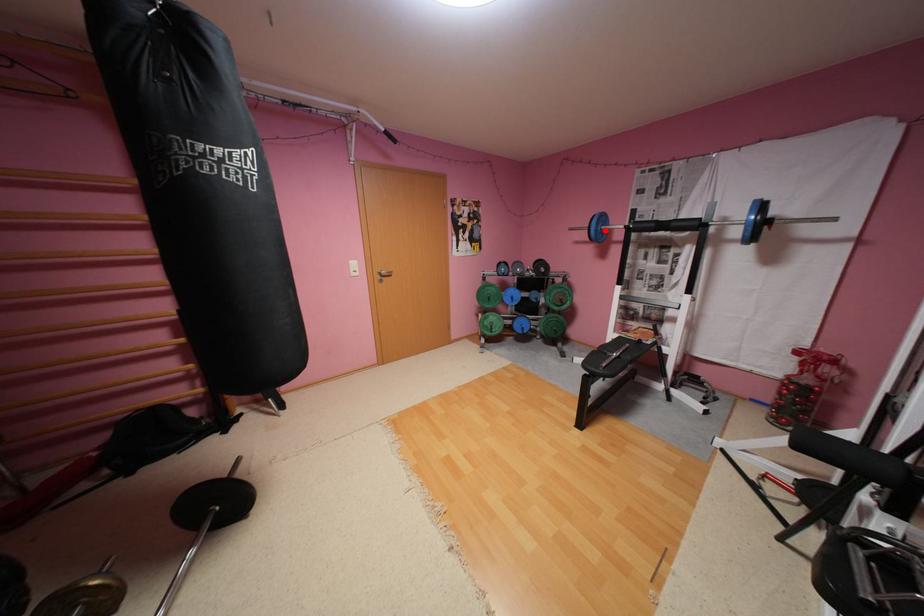
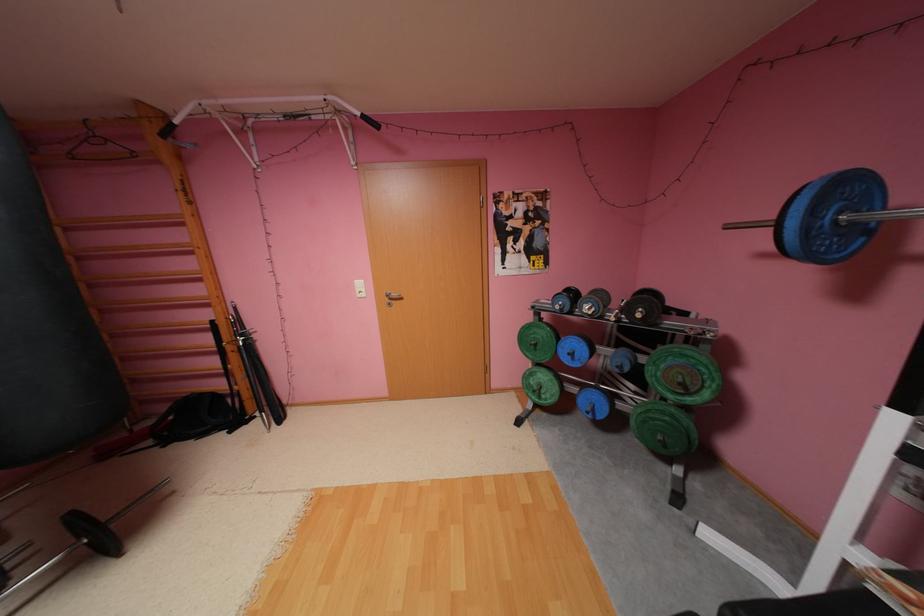
In the second image, find the point that corresponds to the highlighted location in the first image.

(816, 229)